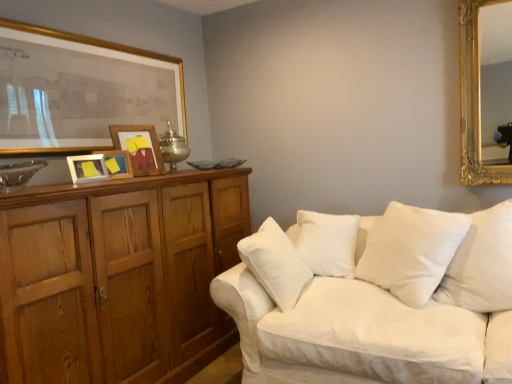
Question: From the image's perspective, is wooden cabinet at left on top of wooden picture frame at left, the third picture frame in the front-to-back sequence?

Choices:
 (A) no
 (B) yes

Answer: (A)

Question: Is wooden cabinet at left facing away from wooden picture frame at left, placed as the 2th picture frame when sorted from back to front?

Choices:
 (A) no
 (B) yes

Answer: (A)

Question: Is wooden cabinet at left touching wooden picture frame at left, the third picture frame in the front-to-back sequence?

Choices:
 (A) yes
 (B) no

Answer: (B)

Question: From a real-world perspective, does wooden cabinet at left stand above wooden picture frame at left, the third picture frame in the front-to-back sequence?

Choices:
 (A) no
 (B) yes

Answer: (A)

Question: Considering the relative sizes of wooden cabinet at left and wooden picture frame at left, the third picture frame in the front-to-back sequence, in the image provided, is wooden cabinet at left wider than wooden picture frame at left, the third picture frame in the front-to-back sequence,?

Choices:
 (A) no
 (B) yes

Answer: (B)

Question: Can you confirm if wooden cabinet at left is positioned to the left of wooden picture frame at left, placed as the 2th picture frame when sorted from back to front?

Choices:
 (A) yes
 (B) no

Answer: (B)

Question: From a real-world perspective, is gold-framed picture at upper left, which appears as the first picture frame when viewed from the front, positioned under white soft cushion at center, which is counted as the 1th pillow, starting from the left, based on gravity?

Choices:
 (A) yes
 (B) no

Answer: (B)

Question: Can you confirm if gold-framed picture at upper left, the fourth picture frame positioned from the back, is taller than white soft cushion at center, which is counted as the 1th pillow, starting from the left?

Choices:
 (A) yes
 (B) no

Answer: (A)

Question: Can you confirm if gold-framed picture at upper left, which appears as the first picture frame when viewed from the front, is smaller than white soft cushion at center, which is counted as the 1th pillow, starting from the left?

Choices:
 (A) yes
 (B) no

Answer: (A)

Question: From the image's perspective, is gold-framed picture at upper left, which appears as the first picture frame when viewed from the front, above white soft cushion at center, the 2th pillow positioned from the right?

Choices:
 (A) no
 (B) yes

Answer: (B)

Question: Is gold-framed picture at upper left, which appears as the first picture frame when viewed from the front, wider than white soft cushion at center, which is counted as the 1th pillow, starting from the left?

Choices:
 (A) yes
 (B) no

Answer: (B)

Question: From the image's perspective, is gold-framed picture at upper left, which appears as the first picture frame when viewed from the front, beneath white soft cushion at center, which is counted as the 1th pillow, starting from the left?

Choices:
 (A) yes
 (B) no

Answer: (B)

Question: Considering the relative sizes of white soft cushion at center, marked as the second pillow in a left-to-right arrangement, and matte white picture frame at upper left, acting as the 3th picture frame starting from the back, in the image provided, is white soft cushion at center, marked as the second pillow in a left-to-right arrangement, shorter than matte white picture frame at upper left, acting as the 3th picture frame starting from the back,?

Choices:
 (A) yes
 (B) no

Answer: (B)